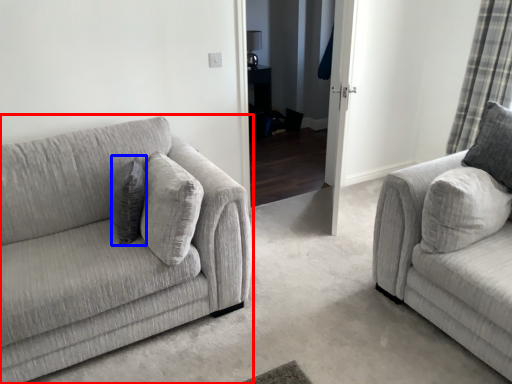
Question: Which object appears farthest to the camera in this image, studio couch (highlighted by a red box) or pillow (highlighted by a blue box)?

Choices:
 (A) studio couch
 (B) pillow

Answer: (B)